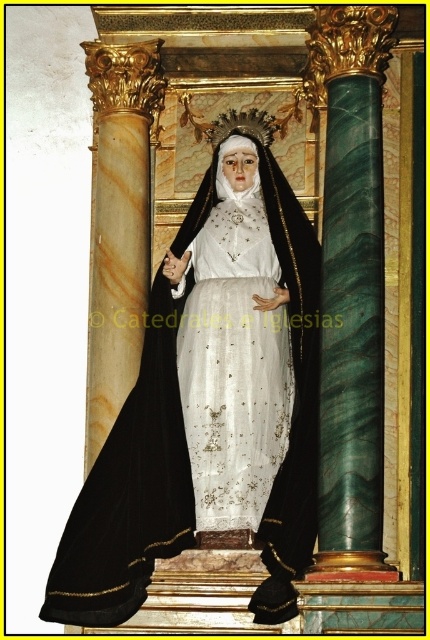
You are an interior designer planning to place a small decorative item on the statue. The item must be placed either on the black velvet cloak at center or the white satin dress at center. Based on their sizes, which surface would provide more space for the item?

The black velvet cloak at center is bigger than the white satin dress at center, so placing the item on the black velvet cloak at center would provide more space.

You are an art conservator examining the religious statue. You need to determine the exact position of the black velvet cloak at center relative to the columns in the niche. Can you identify which column is closer to the cloak?

The black velvet cloak at center is located at point [211,404]. Since the columns are positioned on either side of the niche, the left column is closer to the cloak compared to the right column.